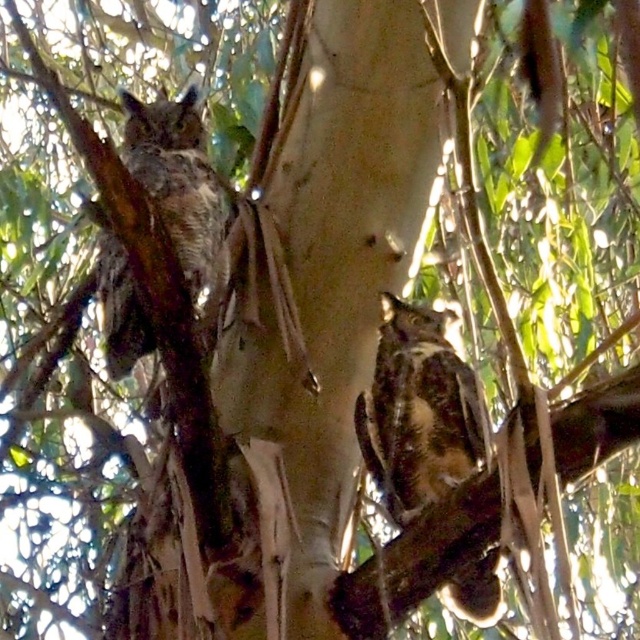
Which is below, brown speckled owl at center or brown speckled owl at left?

brown speckled owl at center is below.

Is brown speckled owl at center closer to the viewer compared to brown speckled owl at left?

No, it is not.

Is point (428, 500) closer to camera compared to point (141, 112)?

Yes, it is.

Identify the location of brown speckled owl at center. (419, 410).